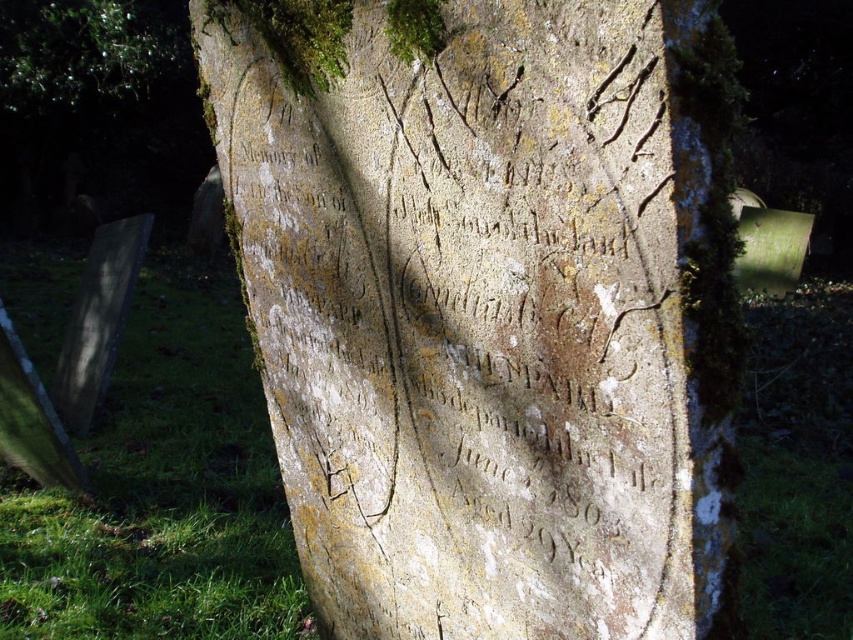
Question: Which of these objects is positioned farthest from the green grass at center?

Choices:
 (A) green mossy tree at upper left
 (B) weathered stone gravestone at center

Answer: (A)

Question: Which object is positioned farthest from the weathered stone gravestone at center?

Choices:
 (A) green mossy tree at upper left
 (B) green grass at center

Answer: (A)

Question: Is green grass at center wider than green mossy tree at upper left?

Choices:
 (A) yes
 (B) no

Answer: (B)

Question: Based on their relative distances, which object is nearer to the weathered stone gravestone at center?

Choices:
 (A) green grass at center
 (B) green mossy tree at upper left

Answer: (A)

Question: Can you confirm if weathered stone gravestone at center is thinner than green mossy tree at upper left?

Choices:
 (A) yes
 (B) no

Answer: (A)

Question: Is weathered stone gravestone at center thinner than green mossy tree at upper left?

Choices:
 (A) no
 (B) yes

Answer: (B)